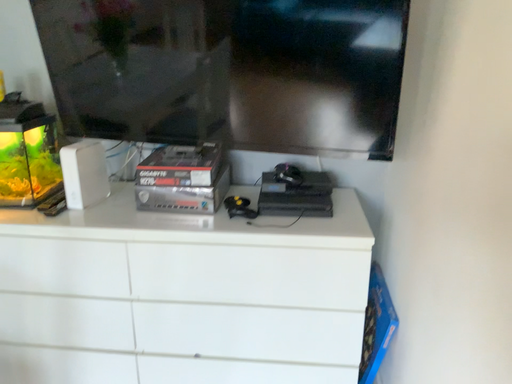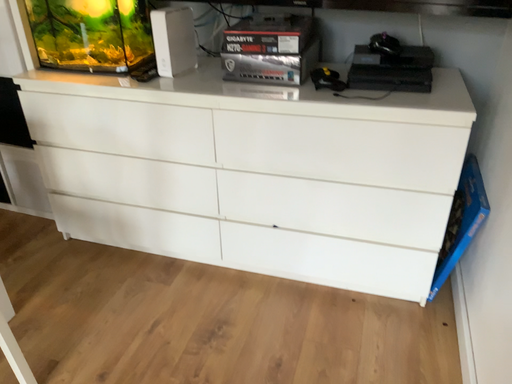
Question: How did the camera likely rotate when shooting the video?

Choices:
 (A) rotated left
 (B) rotated right

Answer: (A)